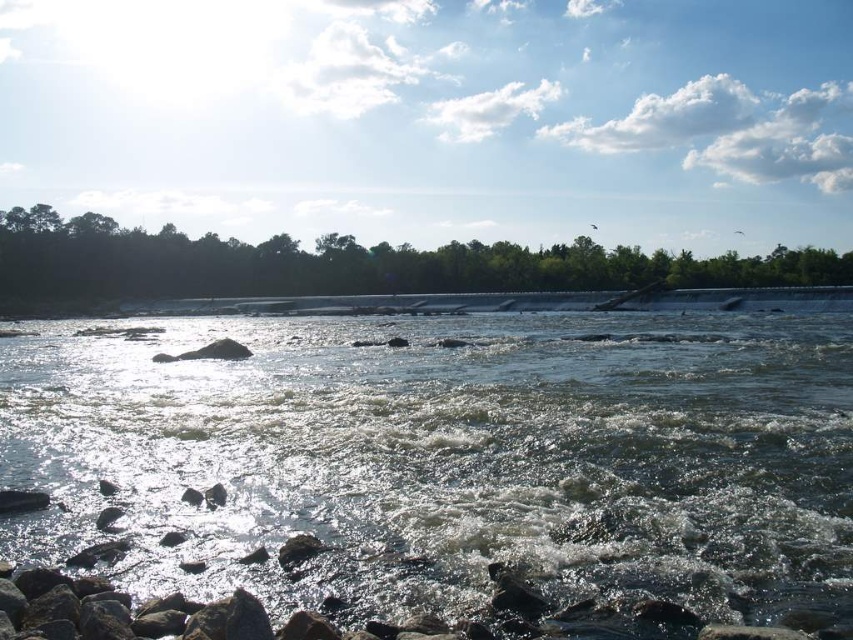
Question: Which point is closer to the camera taking this photo?

Choices:
 (A) (35, 227)
 (B) (599, 513)

Answer: (B)

Question: Is greenish water at center below green leafy trees at upper center?

Choices:
 (A) no
 (B) yes

Answer: (B)

Question: Is greenish water at center to the left of green leafy trees at upper center from the viewer's perspective?

Choices:
 (A) no
 (B) yes

Answer: (A)

Question: In this image, where is greenish water at center located relative to green leafy trees at upper center?

Choices:
 (A) above
 (B) below

Answer: (B)

Question: Which of the following is the farthest from the observer?

Choices:
 (A) (386, 246)
 (B) (721, 509)

Answer: (A)